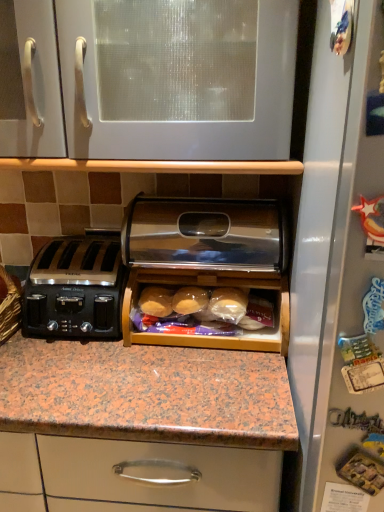
Where is `black plastic toaster at left`? The width and height of the screenshot is (384, 512). black plastic toaster at left is located at coordinates (75, 289).

Find the location of a particular element. The height and width of the screenshot is (512, 384). white glossy cabinet at upper center is located at coordinates (177, 78).

Consider the image. Looking at their sizes, would you say wooden bread box at center is wider or thinner than black plastic toaster at left?

wooden bread box at center is thinner than black plastic toaster at left.

Is wooden bread box at center at the left side of black plastic toaster at left?

No.

Is wooden bread box at center aimed at black plastic toaster at left?

No.

In the scene shown: Considering the sizes of objects black plastic toaster at left and white glossy cabinet at upper center in the image provided, who is shorter, black plastic toaster at left or white glossy cabinet at upper center?

Standing shorter between the two is black plastic toaster at left.

Relative to white glossy cabinet at upper center, is black plastic toaster at left in front or behind?

black plastic toaster at left is positioned farther from the viewer than white glossy cabinet at upper center.

Does black plastic toaster at left have a smaller size compared to white glossy cabinet at upper center?

Yes, black plastic toaster at left is smaller than white glossy cabinet at upper center.

Can you confirm if wooden bread box at center is taller than white glossy cabinet at upper center?

No.

From a real-world perspective, who is located lower, wooden bread box at center or white glossy cabinet at upper center?

From a 3D spatial view, wooden bread box at center is below.

Which is in front, point (234, 243) or point (59, 36)?

Point (59, 36)

From the image's perspective, is wooden bread box at center above white glossy cabinet at upper center?

No.

Considering the relative sizes of white glossy cabinet at upper center and wooden bread box at center in the image provided, is white glossy cabinet at upper center taller than wooden bread box at center?

Indeed, white glossy cabinet at upper center has a greater height compared to wooden bread box at center.

Does white glossy cabinet at upper center touch wooden bread box at center?

white glossy cabinet at upper center and wooden bread box at center are not in contact.

Is white glossy cabinet at upper center turned away from wooden bread box at center?

No, wooden bread box at center is not at the back of white glossy cabinet at upper center.

From a real-world perspective, is white glossy cabinet at upper center beneath wooden bread box at center?

No, from a real-world perspective, white glossy cabinet at upper center is not beneath wooden bread box at center.

In order to click on toaster located underneath the white glossy cabinet at upper center (from a real-world perspective) in this screenshot , I will do `click(75, 289)`.

Is white glossy cabinet at upper center taller or shorter than black plastic toaster at left?

In the image, white glossy cabinet at upper center appears to be taller than black plastic toaster at left.

Would you say white glossy cabinet at upper center is inside or outside black plastic toaster at left?

white glossy cabinet at upper center is outside black plastic toaster at left.

Measure the distance from black plastic toaster at left to wooden bread box at center.

They are 8.09 inches apart.

Between black plastic toaster at left and wooden bread box at center, which one has smaller size?

With smaller size is black plastic toaster at left.

Which is more to the right, black plastic toaster at left or wooden bread box at center?

wooden bread box at center is more to the right.

Where is `home appliance below the black plastic toaster at left (from the image's perspective)`? This screenshot has height=512, width=384. home appliance below the black plastic toaster at left (from the image's perspective) is located at coordinates (208, 259).

You are a GUI agent. You are given a task and a screenshot of the screen. Output one action in this format:
    pyautogui.click(x=<x>, y=<y>)
    Task: Click on the home appliance on the right of the black plastic toaster at left
    The image size is (384, 512).
    Given the screenshot: What is the action you would take?
    pyautogui.click(x=208, y=259)

Locate an element on the screen. The image size is (384, 512). cabinetry above the black plastic toaster at left (from the image's perspective) is located at coordinates (177, 78).

Which object lies further to the anchor point white glossy cabinet at upper center, black plastic toaster at left or wooden bread box at center?

black plastic toaster at left is positioned further to the anchor white glossy cabinet at upper center.

From the image, which object appears to be nearer to black plastic toaster at left, wooden bread box at center or white glossy cabinet at upper center?

The object closer to black plastic toaster at left is wooden bread box at center.

Estimate the real-world distances between objects in this image. Which object is further from white glossy cabinet at upper center, wooden bread box at center or black plastic toaster at left?

black plastic toaster at left is further to white glossy cabinet at upper center.

Based on their spatial positions, is black plastic toaster at left or white glossy cabinet at upper center closer to wooden bread box at center?

Among the two, black plastic toaster at left is located nearer to wooden bread box at center.

Based on their spatial positions, is white glossy cabinet at upper center or wooden bread box at center closer to black plastic toaster at left?

wooden bread box at center is closer to black plastic toaster at left.

Estimate the real-world distances between objects in this image. Which object is closer to wooden bread box at center, white glossy cabinet at upper center or black plastic toaster at left?

Among the two, black plastic toaster at left is located nearer to wooden bread box at center.

At what (x,y) coordinates should I click in order to perform the action: click on toaster between white glossy cabinet at upper center and wooden bread box at center in the up-down direction. Please return your answer as a coordinate pair (x, y). The image size is (384, 512). Looking at the image, I should click on (75, 289).